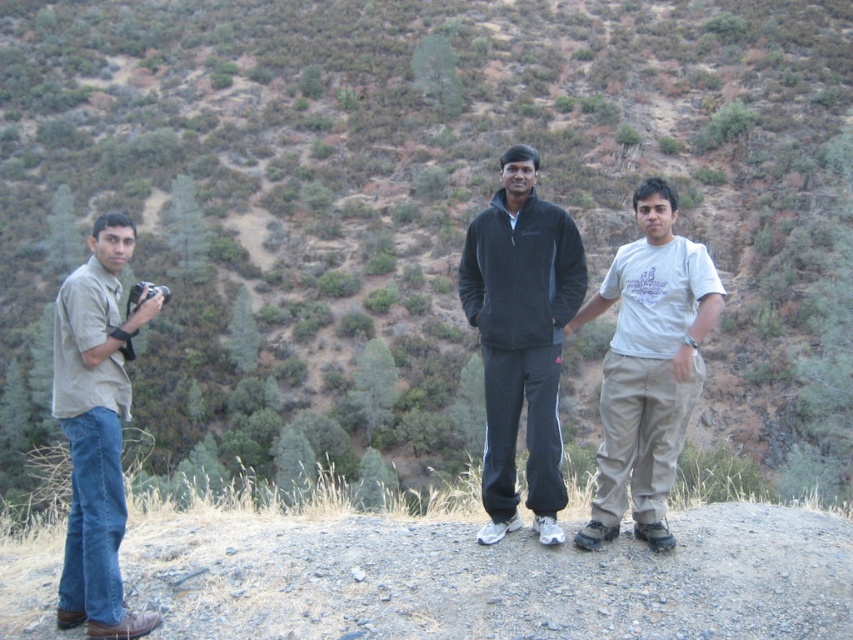
Does white cotton shirt at center appear on the left side of beige cotton shirt at left?

No, white cotton shirt at center is not to the left of beige cotton shirt at left.

Does point (650, 243) come in front of point (85, 541)?

No, (650, 243) is further to viewer.

Find the location of a particular element. The image size is (853, 640). white cotton shirt at center is located at coordinates (648, 365).

Is black fleece tracksuit at center further to the viewer compared to white cotton shirt at center?

That is True.

Can you confirm if black fleece tracksuit at center is shorter than white cotton shirt at center?

Yes.

This screenshot has width=853, height=640. What do you see at coordinates (521, 339) in the screenshot?
I see `black fleece tracksuit at center` at bounding box center [521, 339].

Locate an element on the screen. This screenshot has height=640, width=853. black fleece tracksuit at center is located at coordinates (521, 339).

Can you confirm if gray gravel at center is positioned below white cotton shirt at center?

Correct, gray gravel at center is located below white cotton shirt at center.

In the scene shown: Can you confirm if gray gravel at center is positioned to the left of white cotton shirt at center?

Correct, you'll find gray gravel at center to the left of white cotton shirt at center.

Between point (128, 570) and point (625, 435), which one is positioned behind?

Positioned behind is point (625, 435).

Find the location of a particular element. gray gravel at center is located at coordinates (492, 579).